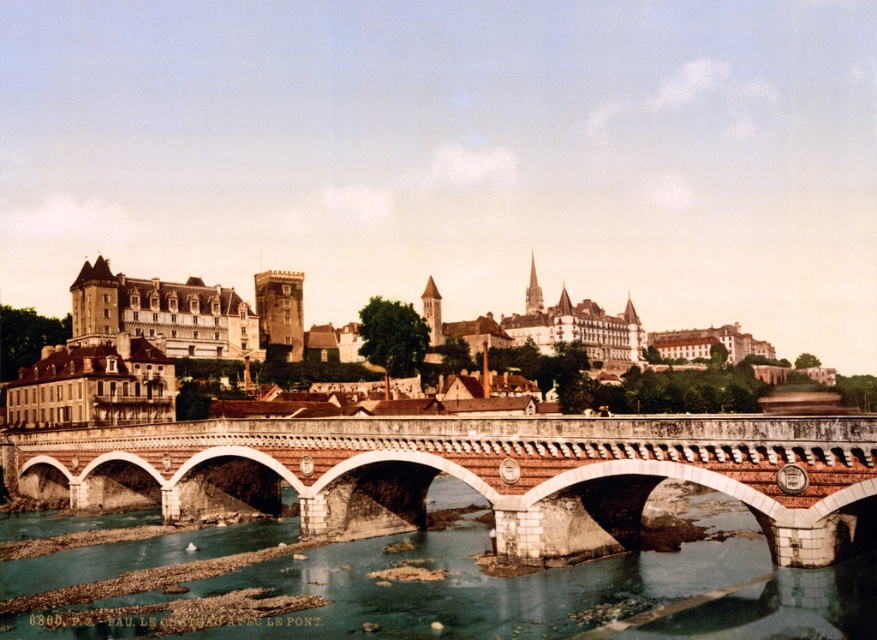
Who is shorter, clear water at bridge center or matte stone building at center?

With less height is clear water at bridge center.

Which is below, clear water at bridge center or matte stone building at center?

clear water at bridge center is lower down.

Where is `clear water at bridge center`? clear water at bridge center is located at coordinates (522, 586).

Find the location of `clear water at bridge center`. clear water at bridge center is located at coordinates (522, 586).

Does brick stone bridge at center have a greater height compared to clear water at bridge center?

Correct, brick stone bridge at center is much taller as clear water at bridge center.

Is brick stone bridge at center positioned in front of clear water at bridge center?

No, brick stone bridge at center is behind clear water at bridge center.

Which is behind, point (626, 445) or point (858, 636)?

Point (626, 445)

You are a GUI agent. You are given a task and a screenshot of the screen. Output one action in this format:
    pyautogui.click(x=<x>, y=<y>)
    Task: Click on the brick stone bridge at center
    
    Given the screenshot: What is the action you would take?
    pyautogui.click(x=475, y=474)

Can you confirm if brick stone bridge at center is positioned below matte stone building at center?

Correct, brick stone bridge at center is located below matte stone building at center.

Based on the photo, does brick stone bridge at center have a larger size compared to matte stone building at center?

No, brick stone bridge at center is not bigger than matte stone building at center.

Which is behind, point (365, 532) or point (210, 301)?

The point (210, 301) is behind.

Find the location of `brick stone bridge at center`. brick stone bridge at center is located at coordinates (475, 474).